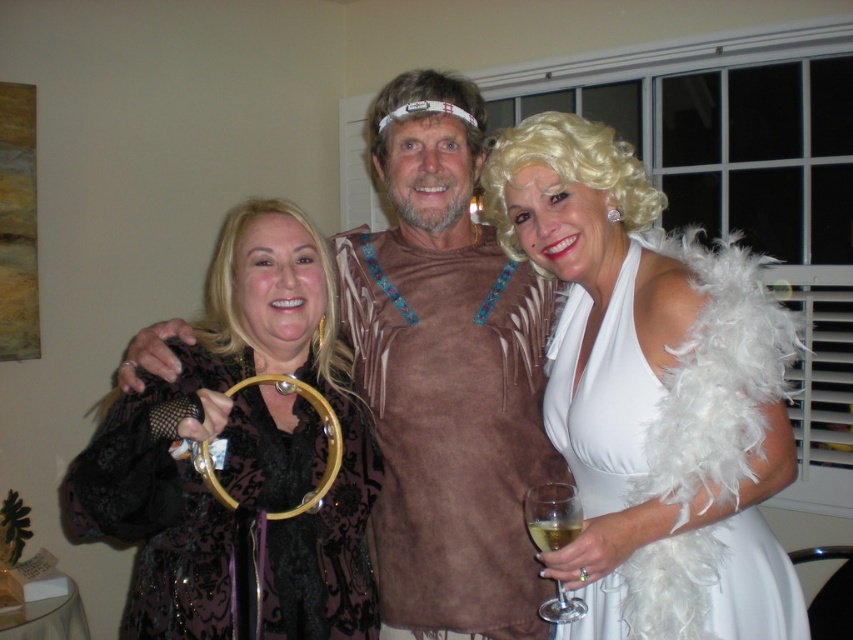
Does point (650, 211) lie in front of point (433, 76)?

That is True.

Between point (595, 150) and point (482, 99), which one is positioned in front?

Point (595, 150) is in front.

The image size is (853, 640). Find the location of `blonde feather boa at right`. blonde feather boa at right is located at coordinates (567, 170).

In the scene shown: Which is more to the right, suede-like brown vest at center or white feathered wig at center?

suede-like brown vest at center

Is suede-like brown vest at center to the right of white feathered wig at center from the viewer's perspective?

Yes, suede-like brown vest at center is to the right of white feathered wig at center.

Who is more forward, (514, 285) or (437, 92)?

Point (437, 92)

Locate an element on the screen. suede-like brown vest at center is located at coordinates (451, 428).

Does point (297, 230) come behind point (399, 102)?

No, (297, 230) is in front of (399, 102).

Where is `black lace tambourine at left`? Image resolution: width=853 pixels, height=640 pixels. black lace tambourine at left is located at coordinates (239, 451).